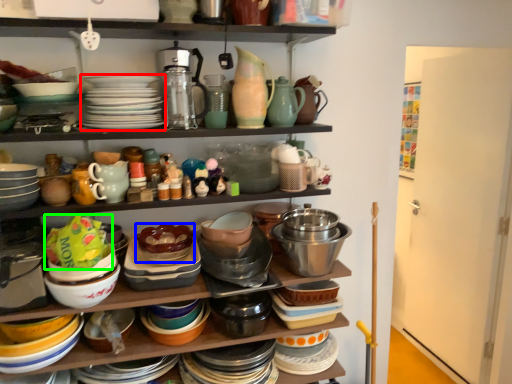
Question: Based on their relative distances, which object is nearer to platter (highlighted by a red box)? Choose from bowl (highlighted by a blue box) and food (highlighted by a green box).

Choices:
 (A) bowl
 (B) food

Answer: (B)